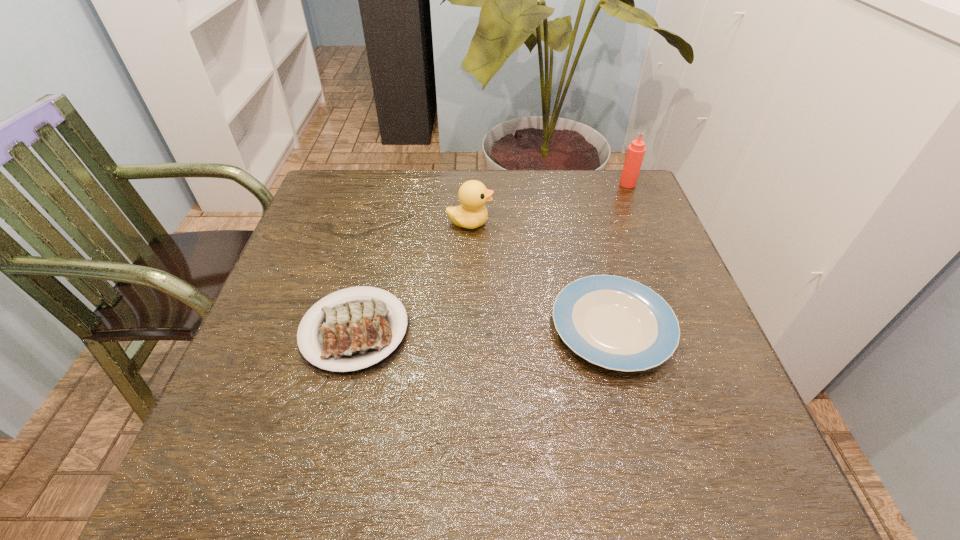
The height and width of the screenshot is (540, 960). I want to click on Tabasco sauce that is at the far edge, so click(636, 150).

The image size is (960, 540). What are the coordinates of `duck at the far edge` in the screenshot? It's located at (473, 195).

What are the coordinates of `object at the left edge` in the screenshot? It's located at (353, 333).

Find the location of a particular element. Tabasco sauce that is at the right edge is located at coordinates (636, 150).

You are a GUI agent. You are given a task and a screenshot of the screen. Output one action in this format:
    pyautogui.click(x=<x>, y=<y>)
    Task: Click on the plate positioned at the right edge
    
    Given the screenshot: What is the action you would take?
    pyautogui.click(x=617, y=323)

I want to click on object located in the far right corner section of the desktop, so click(x=636, y=150).

Find the location of a particular element. free space at the far edge of the desktop is located at coordinates (394, 192).

The height and width of the screenshot is (540, 960). Identify the location of vacant point at the left edge. (297, 283).

What are the coordinates of `vacant space at the right edge of the desktop` in the screenshot? It's located at (688, 320).

In the image, there is a desktop. Where is `free region at the near left corner`? The height and width of the screenshot is (540, 960). free region at the near left corner is located at coordinates (261, 475).